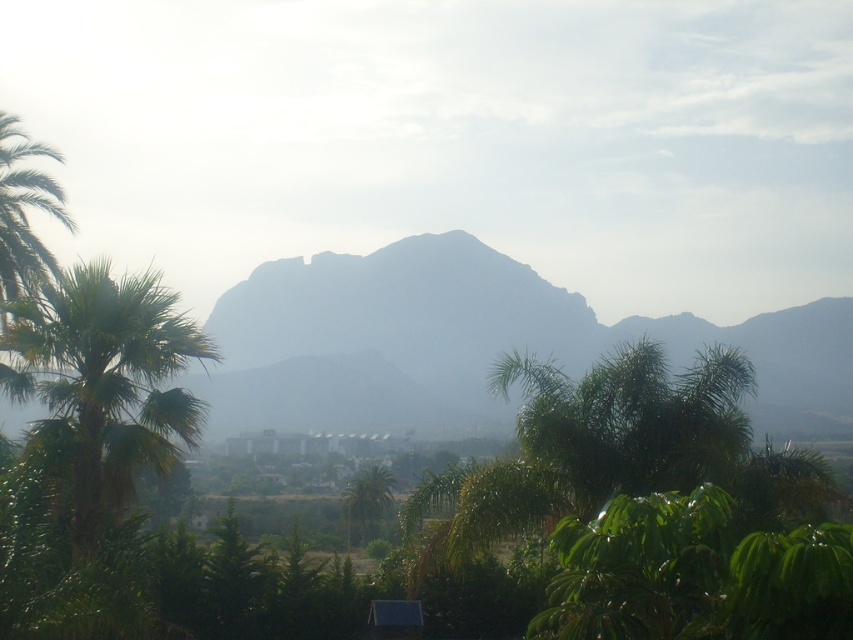
You are planning to take a photo of the smokey gray mountain at center and the green leafy palm tree at left. Which object should you focus on first if you want to capture both in a single frame without moving the camera?

The smokey gray mountain at center is taller than the green leafy palm tree at left, so you should focus on the smokey gray mountain at center first to ensure it fits within the frame.

You are a photographer standing at the edge of a tropical forest, and you want to take a photo of the smokey gray mountain at center. The camera you are using has a maximum focus range of 20 meters. Will the mountain be in focus?

The smokey gray mountain at center is 18.77 meters from the camera, which is within the 20 meters maximum focus range. Therefore, the mountain will be in focus.